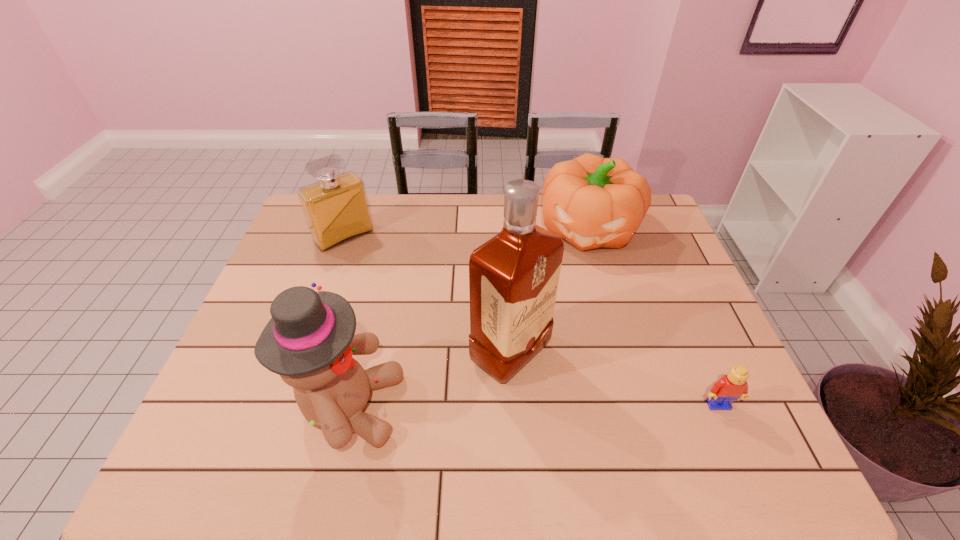
Find the location of `rag_doll`. rag_doll is located at coordinates (309, 341).

What are the coordinates of `the shortest object` in the screenshot? It's located at (730, 387).

You are a GUI agent. You are given a task and a screenshot of the screen. Output one action in this format:
    pyautogui.click(x=<x>, y=<y>)
    Task: Click on the pumpkin
    The image size is (960, 540).
    Given the screenshot: What is the action you would take?
    pyautogui.click(x=592, y=202)

You are a GUI agent. You are given a task and a screenshot of the screen. Output one action in this format:
    pyautogui.click(x=<x>, y=<y>)
    Task: Click on the perfume
    Image resolution: width=960 pixels, height=540 pixels.
    Given the screenshot: What is the action you would take?
    pyautogui.click(x=336, y=209)

You are a GUI agent. You are given a task and a screenshot of the screen. Output one action in this format:
    pyautogui.click(x=<x>, y=<y>)
    Task: Click on the tallest object
    
    Given the screenshot: What is the action you would take?
    (513, 278)

Find the location of a particular element. The height and width of the screenshot is (540, 960). liquor is located at coordinates (513, 278).

Find the location of `vacant point located 0.280m on the front-facing side of the fourth shortest object`. vacant point located 0.280m on the front-facing side of the fourth shortest object is located at coordinates (524, 407).

Locate an element on the screen. The width and height of the screenshot is (960, 540). vacant space located 0.370m on the carved face of the pumpkin is located at coordinates (555, 353).

Where is `vacant space situated 0.380m on the carved face of the pumpkin`? vacant space situated 0.380m on the carved face of the pumpkin is located at coordinates (554, 356).

Image resolution: width=960 pixels, height=540 pixels. I want to click on vacant space positioned 0.300m on the carved face of the pumpkin, so [561, 332].